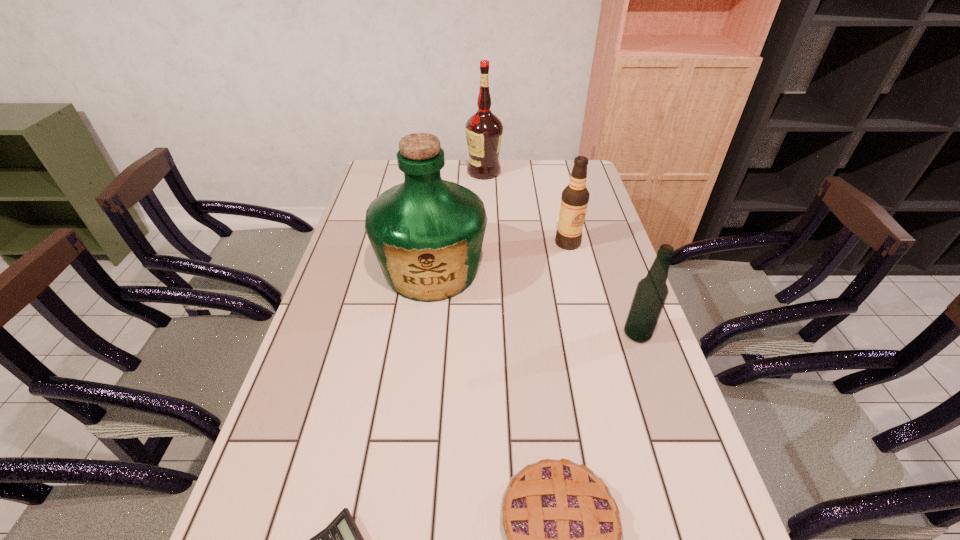
Point out which object is positioned as the third nearest to the second alcohol from right to left. Please provide its 2D coordinates. Your answer should be formatted as a tuple, i.e. [(x, y)], where the tuple contains the x and y coordinates of a point satisfying the conditions above.

[(484, 130)]

Locate which alcohol ranks in proximity to the second alcohol from left to right. Please provide its 2D coordinates. Your answer should be formatted as a tuple, i.e. [(x, y)], where the tuple contains the x and y coordinates of a point satisfying the conditions above.

[(651, 293)]

Select which alcohol appears as the second closest to the leftmost alcohol. Please provide its 2D coordinates. Your answer should be formatted as a tuple, i.e. [(x, y)], where the tuple contains the x and y coordinates of a point satisfying the conditions above.

[(651, 293)]